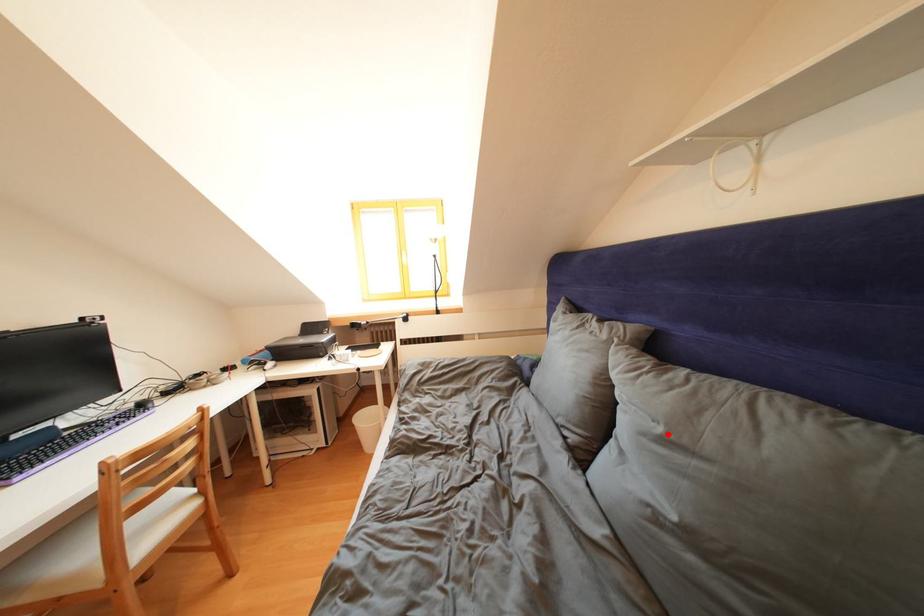
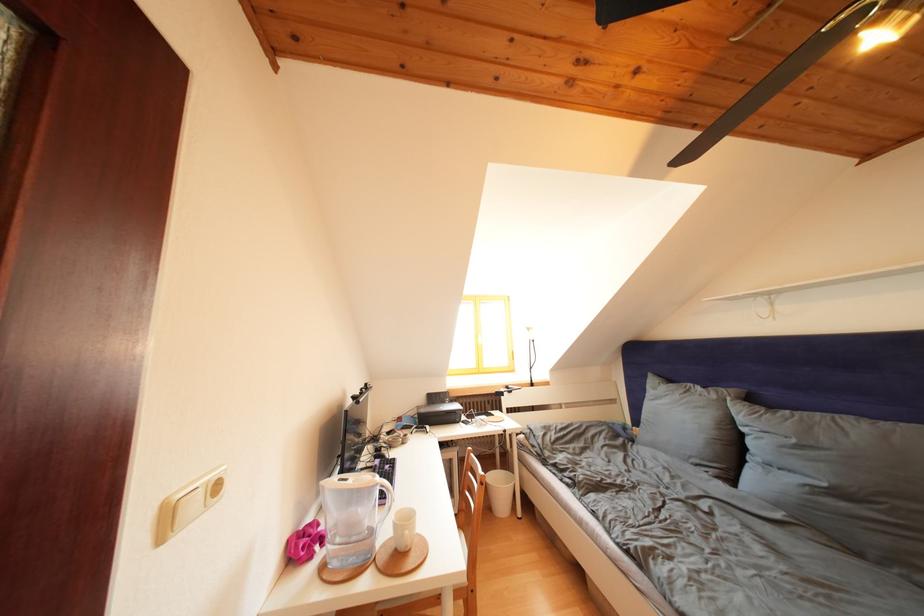
The point at the highlighted location is marked in the first image. Where is the corresponding point in the second image?

(801, 446)